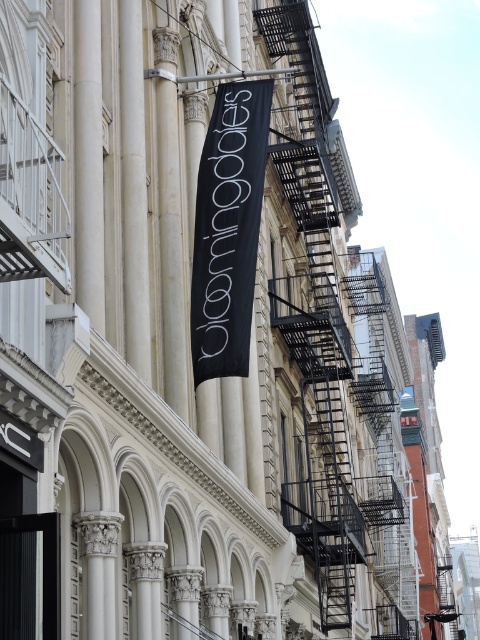
Question: Which of the following is the farthest from the observer?

Choices:
 (A) black fabric banner at center
 (B) black metal fire escape at upper right

Answer: (A)

Question: Can you confirm if black metal fire escape at upper right is positioned to the right of black fabric banner at center?

Choices:
 (A) no
 (B) yes

Answer: (B)

Question: Can you confirm if black metal fire escape at upper right is smaller than black fabric banner at center?

Choices:
 (A) yes
 (B) no

Answer: (B)

Question: Can you confirm if black metal fire escape at upper right is positioned below black fabric banner at center?

Choices:
 (A) no
 (B) yes

Answer: (B)